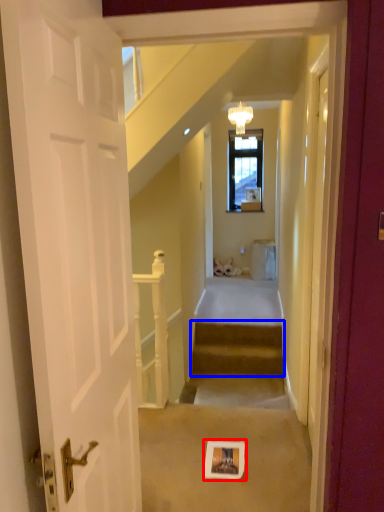
Question: Which object appears farthest to the camera in this image, picture frame (highlighted by a red box) or stairs (highlighted by a blue box)?

Choices:
 (A) picture frame
 (B) stairs

Answer: (B)